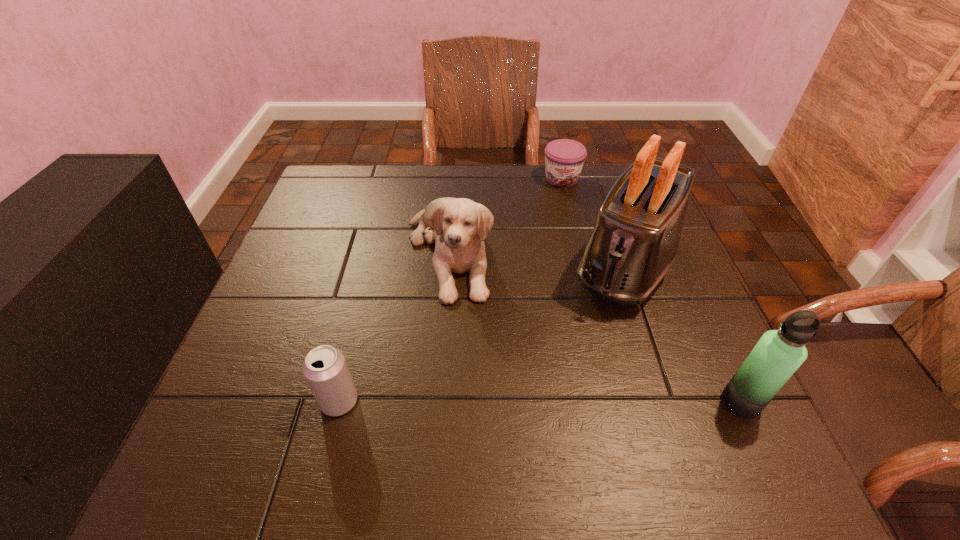
Locate an element on the screen. Image resolution: width=960 pixels, height=540 pixels. the fourth tallest object is located at coordinates click(325, 369).

At what (x,y) coordinates should I click in order to perform the action: click on beer can. Please return your answer as a coordinate pair (x, y). Looking at the image, I should click on (325, 369).

Where is `thermos bottle`? This screenshot has width=960, height=540. thermos bottle is located at coordinates (779, 353).

This screenshot has width=960, height=540. What are the coordinates of `toaster` in the screenshot? It's located at (633, 245).

Image resolution: width=960 pixels, height=540 pixels. Identify the location of the shortest object. (564, 158).

I want to click on jam, so click(x=564, y=158).

Identify the location of the fourth object from right to left. Image resolution: width=960 pixels, height=540 pixels. (460, 226).

Find the location of `the third shortest object`. the third shortest object is located at coordinates (460, 226).

Where is `blank space located on the back of the leftmost object`? blank space located on the back of the leftmost object is located at coordinates (377, 248).

Identify the location of free spot located on the back of the thermos bottle. (684, 278).